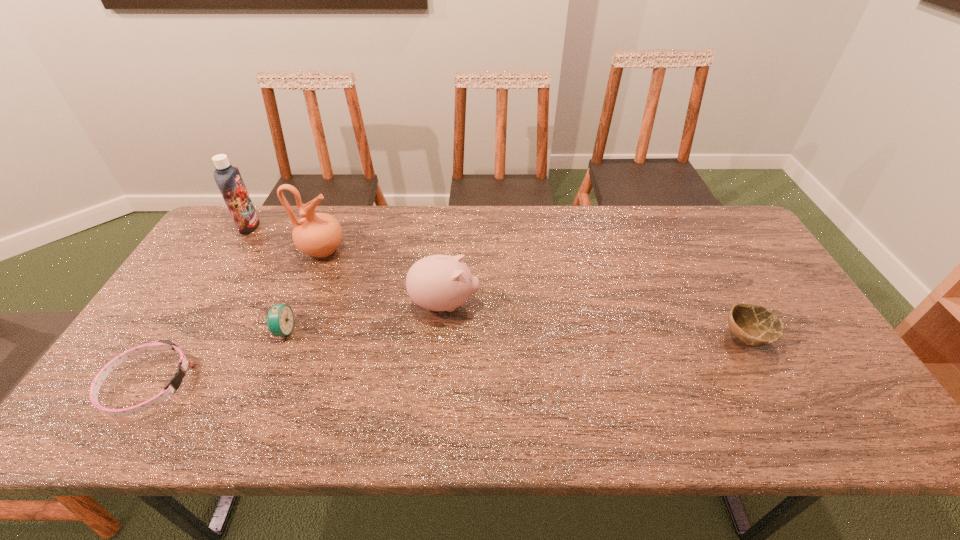
Locate an element on the screen. This screenshot has height=540, width=960. free space located at the snout of the piggy bank is located at coordinates (587, 304).

Where is `vacant space located on the front-facing side of the alarm clock`? vacant space located on the front-facing side of the alarm clock is located at coordinates (377, 330).

You are a GUI agent. You are given a task and a screenshot of the screen. Output one action in this format:
    pyautogui.click(x=<x>, y=<y>)
    Task: Click on the vacant space located on the left of the bowl
    The height and width of the screenshot is (540, 960).
    Given the screenshot: What is the action you would take?
    pyautogui.click(x=588, y=338)

Locate an element on the screen. The width and height of the screenshot is (960, 540). vacant space located with the buckle on the shortest object is located at coordinates [x=221, y=384].

Find the location of a particular element. The height and width of the screenshot is (540, 960). shampoo present at the far edge is located at coordinates (228, 178).

Image resolution: width=960 pixels, height=540 pixels. Identify the location of pottery at the far edge. (317, 234).

Locate an element on the screen. object at the near edge is located at coordinates (176, 380).

Where is `shampoo located in the left edge section of the desktop`? This screenshot has width=960, height=540. shampoo located in the left edge section of the desktop is located at coordinates (228, 178).

Identify the location of dog collar that is at the left edge. Image resolution: width=960 pixels, height=540 pixels. (176, 380).

The width and height of the screenshot is (960, 540). What are the coordinates of `object that is at the right edge` in the screenshot? It's located at (754, 325).